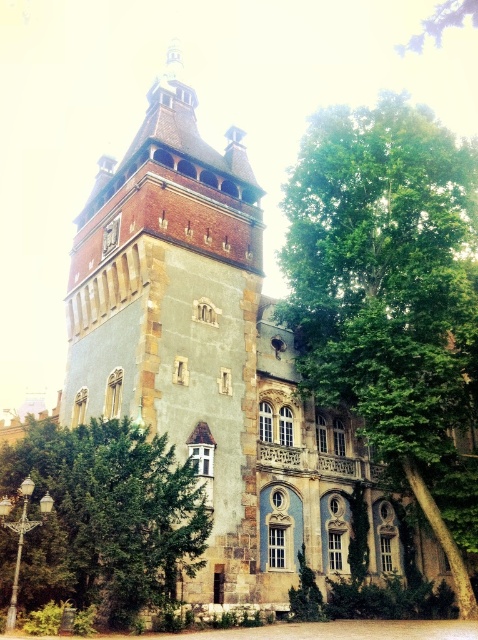
Question: Does green leafy tree at right appear over green leafy tree at lower left?

Choices:
 (A) no
 (B) yes

Answer: (B)

Question: Is green leafy tree at right thinner than green leafy tree at lower left?

Choices:
 (A) no
 (B) yes

Answer: (A)

Question: Which of the following is the farthest from the observer?

Choices:
 (A) pyautogui.click(x=8, y=445)
 (B) pyautogui.click(x=437, y=403)

Answer: (B)

Question: Which of the following is the closest to the observer?

Choices:
 (A) green leafy tree at lower left
 (B) green leafy tree at right

Answer: (A)

Question: Can you confirm if green leafy tree at right is wider than green leafy tree at lower left?

Choices:
 (A) no
 (B) yes

Answer: (B)